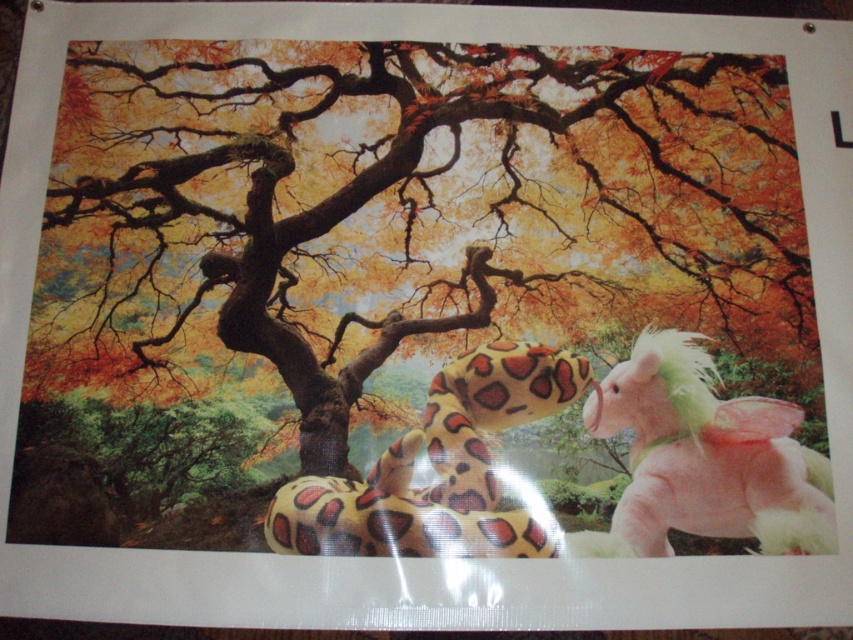
You are standing in front of the autumnal scene. There is a point at coordinates (402,214). What object is located at this point?

The autumn leaves at center are located at point (402,214).

You are a child trying to place a new toy between the pink plush toy at right and the fluffy yellow snake at center. The new toy is 3 inches long. Will there be enough space between them to fit the new toy?

The distance between the pink plush toy at right and the fluffy yellow snake at center is 3.55 inches, which is more than the 3 inches required for the new toy. Therefore, there is enough space to place the new toy between them.